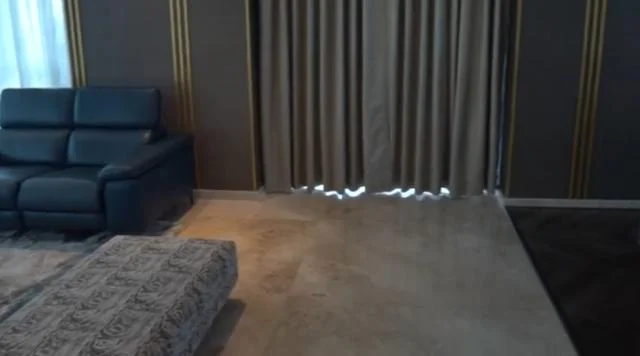
The width and height of the screenshot is (640, 356). In order to click on right recliner in this screenshot , I will do `click(6, 193)`.